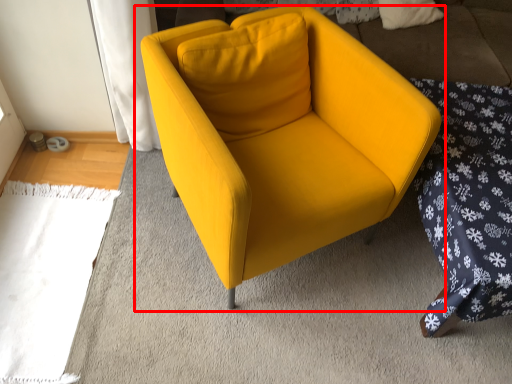
Question: In this image, where is chair (annotated by the red box) located relative to bedding?

Choices:
 (A) right
 (B) left

Answer: (B)